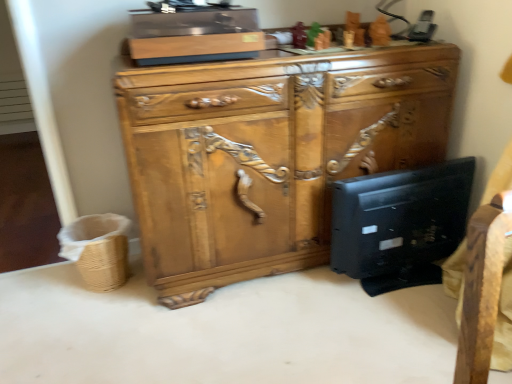
This screenshot has height=384, width=512. Find the location of `vacant area that is in front of woven brown basket at lower left`. vacant area that is in front of woven brown basket at lower left is located at coordinates (87, 317).